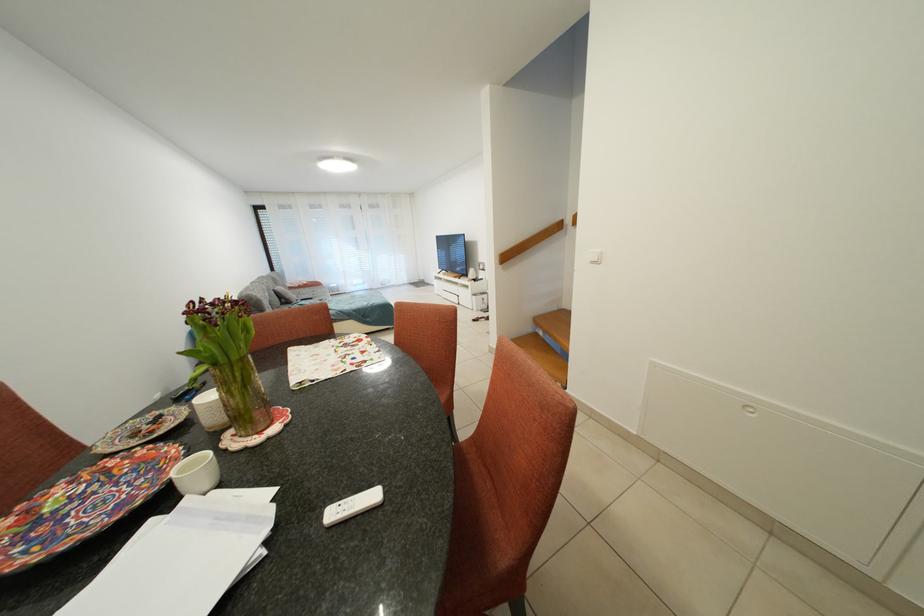
The location [351,506] corresponds to which object?

This point indicates the white remote control.